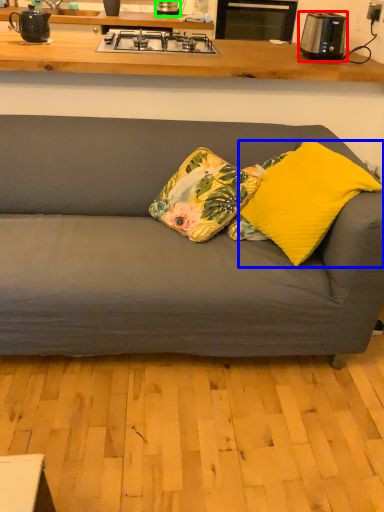
Question: Estimate the real-world distances between objects in this image. Which object is closer to kitchen appliance (highlighted by a red box), pillow (highlighted by a blue box) or kitchen appliance (highlighted by a green box)?

Choices:
 (A) pillow
 (B) kitchen appliance

Answer: (A)